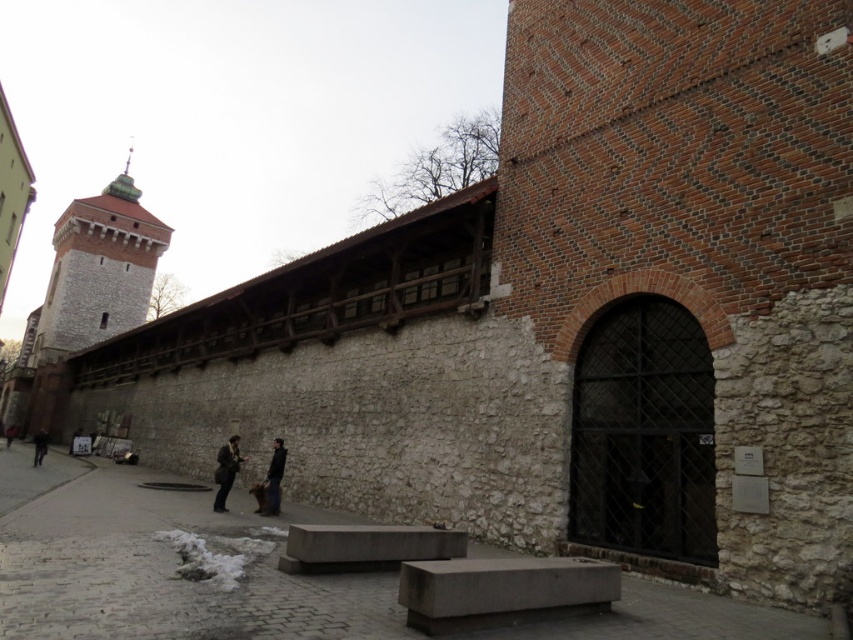
You are standing at the point with coordinates (97, 269) in the historical urban scene. What structure are you closest to?

The point with coordinates (97, 269) corresponds to the gray stone tower at upper left, so you are closest to the gray stone tower at upper left.

Consider the image. You are standing in front of the historical wall and want to touch both points marked on it. Which point, point (227, 452) or point (44, 452), will you reach first as you move forward towards the wall?

Point (227, 452) is closer to the camera than point (44, 452), so you will reach point (227, 452) first as you move forward towards the wall.

You are a tourist standing at the base of the tower and want to sit down. You see the gray concrete bench at center and the dark gray jacket at lower left. Which object is higher up from the ground?

The gray concrete bench at center is located above the dark gray jacket at lower left, so the bench is higher up from the ground.